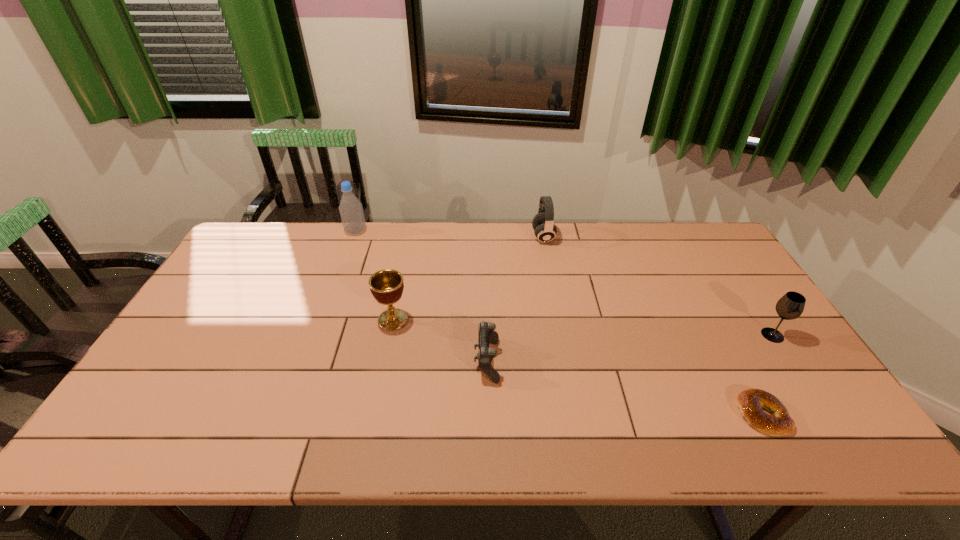
Find the location of a particular element. headset situated at the far edge is located at coordinates (543, 223).

Image resolution: width=960 pixels, height=540 pixels. Find the location of `object that is at the near edge`. object that is at the near edge is located at coordinates (751, 402).

This screenshot has width=960, height=540. Find the location of `wineglass that is at the right edge`. wineglass that is at the right edge is located at coordinates (790, 306).

Find the location of a particular element. This screenshot has width=960, height=540. bagel at the right edge is located at coordinates (751, 402).

The width and height of the screenshot is (960, 540). I want to click on object present at the near right corner, so click(751, 402).

The image size is (960, 540). I want to click on vacant region at the far edge of the desktop, so click(529, 231).

In the image, there is a desktop. Identify the location of vacant space at the near edge. The width and height of the screenshot is (960, 540). (349, 420).

In the image, there is a desktop. Where is `free space at the left edge`? free space at the left edge is located at coordinates (184, 332).

Image resolution: width=960 pixels, height=540 pixels. In the image, there is a desktop. In order to click on free space at the right edge in this screenshot , I will do `click(757, 386)`.

Image resolution: width=960 pixels, height=540 pixels. In the image, there is a desktop. In order to click on vacant space at the near left corner in this screenshot , I will do `click(170, 429)`.